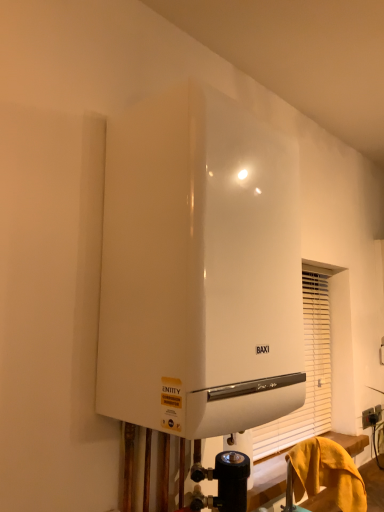
Image resolution: width=384 pixels, height=512 pixels. I want to click on black plastic electric outlet at lower right, so click(x=367, y=417).

Locate an element on the screen. This screenshot has width=384, height=512. white glossy boiler at upper center is located at coordinates (199, 269).

Which of these two, black plastic electric outlet at lower right or yellow fabric at lower right, is bigger?

yellow fabric at lower right.

Can you confirm if black plastic electric outlet at lower right is taller than yellow fabric at lower right?

A: In fact, black plastic electric outlet at lower right may be shorter than yellow fabric at lower right.

From a real-world perspective, between black plastic electric outlet at lower right and yellow fabric at lower right, who is vertically higher?

From a 3D spatial view, yellow fabric at lower right is above.

Can you confirm if black plastic electric outlet at lower right is positioned to the right of yellow fabric at lower right?

Yes, black plastic electric outlet at lower right is to the right of yellow fabric at lower right.

Which object is positioned more to the left, black plastic electric outlet at lower right or white glossy boiler at upper center?

white glossy boiler at upper center is more to the left.

Can you tell me how much black plastic electric outlet at lower right and white glossy boiler at upper center differ in facing direction?

The angular difference between black plastic electric outlet at lower right and white glossy boiler at upper center is 1.75 degrees.

Is black plastic electric outlet at lower right directly adjacent to white glossy boiler at upper center?

No, black plastic electric outlet at lower right is not making contact with white glossy boiler at upper center.

Which of these two, yellow fabric at lower right or white glossy boiler at upper center, is thinner?

yellow fabric at lower right is thinner.

Where is `home appliance that appears in front of the yellow fabric at lower right`? This screenshot has width=384, height=512. home appliance that appears in front of the yellow fabric at lower right is located at coordinates (199, 269).

Considering the relative sizes of yellow fabric at lower right and white glossy boiler at upper center in the image provided, is yellow fabric at lower right smaller than white glossy boiler at upper center?

Correct, yellow fabric at lower right occupies less space than white glossy boiler at upper center.

Is yellow fabric at lower right further to camera compared to white glossy boiler at upper center?

Yes, yellow fabric at lower right is behind white glossy boiler at upper center.

Which is nearer, (275,265) or (346,504)?

Point (275,265).

In terms of width, does white glossy boiler at upper center look wider or thinner when compared to yellow fabric at lower right?

Considering their sizes, white glossy boiler at upper center looks broader than yellow fabric at lower right.

Who is bigger, white glossy boiler at upper center or yellow fabric at lower right?

Bigger between the two is white glossy boiler at upper center.

Would you say white glossy boiler at upper center is inside or outside yellow fabric at lower right?

white glossy boiler at upper center is outside yellow fabric at lower right.

Could you tell me if white glossy boiler at upper center is facing black plastic electric outlet at lower right?

No, white glossy boiler at upper center is not facing towards black plastic electric outlet at lower right.

Does point (291, 351) appear closer or farther from the camera than point (366, 426)?

Point (291, 351) is closer to the camera than point (366, 426).

Is white glossy boiler at upper center situated inside black plastic electric outlet at lower right or outside?

white glossy boiler at upper center is outside black plastic electric outlet at lower right.

How many degrees apart are the facing directions of white glossy boiler at upper center and black plastic electric outlet at lower right?

white glossy boiler at upper center and black plastic electric outlet at lower right are facing 1.75 degrees away from each other.

From the image's perspective, is yellow fabric at lower right beneath black plastic electric outlet at lower right?

No, from the image's perspective, yellow fabric at lower right is not beneath black plastic electric outlet at lower right.

In the scene shown: From a real-world perspective, is yellow fabric at lower right above or below black plastic electric outlet at lower right?

yellow fabric at lower right is situated higher than black plastic electric outlet at lower right in the real world.

In the scene shown: Is yellow fabric at lower right at the right side of black plastic electric outlet at lower right?

No, yellow fabric at lower right is not to the right of black plastic electric outlet at lower right.

Does yellow fabric at lower right have a smaller size compared to black plastic electric outlet at lower right?

No, yellow fabric at lower right is not smaller than black plastic electric outlet at lower right.

Find the location of a particular element. electric outlet on the right of the yellow fabric at lower right is located at coordinates (367, 417).

At what (x,y) coordinates should I click in order to perform the action: click on home appliance that appears above the black plastic electric outlet at lower right (from the image's perspective). Please return your answer as a coordinate pair (x, y). This screenshot has height=512, width=384. Looking at the image, I should click on (199, 269).

When comparing their distances from black plastic electric outlet at lower right, does yellow fabric at lower right or white glossy boiler at upper center seem further?

The object further to black plastic electric outlet at lower right is white glossy boiler at upper center.

Considering their positions, is black plastic electric outlet at lower right positioned further to white glossy boiler at upper center than yellow fabric at lower right?

black plastic electric outlet at lower right lies further to white glossy boiler at upper center than the other object.

When comparing their distances from yellow fabric at lower right, does black plastic electric outlet at lower right or white glossy boiler at upper center seem further?

white glossy boiler at upper center lies further to yellow fabric at lower right than the other object.

When comparing their distances from yellow fabric at lower right, does white glossy boiler at upper center or black plastic electric outlet at lower right seem further?

Among the two, white glossy boiler at upper center is located further to yellow fabric at lower right.

Based on their spatial positions, is white glossy boiler at upper center or yellow fabric at lower right closer to black plastic electric outlet at lower right?

yellow fabric at lower right lies closer to black plastic electric outlet at lower right than the other object.

Based on their spatial positions, is yellow fabric at lower right or black plastic electric outlet at lower right further from white glossy boiler at upper center?

black plastic electric outlet at lower right is positioned further to the anchor white glossy boiler at upper center.

At what (x,y) coordinates should I click in order to perform the action: click on furniture positioned between white glossy boiler at upper center and black plastic electric outlet at lower right from near to far. Please return your answer as a coordinate pair (x, y). This screenshot has width=384, height=512. Looking at the image, I should click on (327, 473).